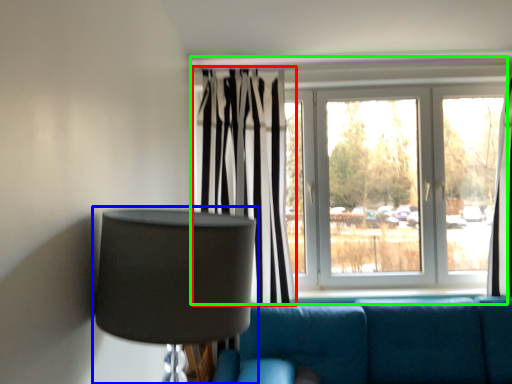
Question: Which is nearer to the curtain (highlighted by a red box)? lamp (highlighted by a blue box) or window (highlighted by a green box).

Choices:
 (A) lamp
 (B) window

Answer: (B)